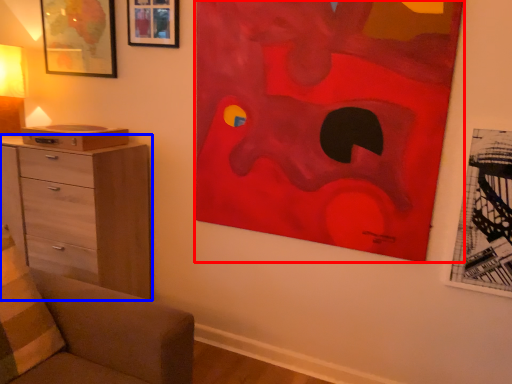
Question: Which object is further to the camera taking this photo, art (highlighted by a red box) or chest of drawers (highlighted by a blue box)?

Choices:
 (A) art
 (B) chest of drawers

Answer: (B)